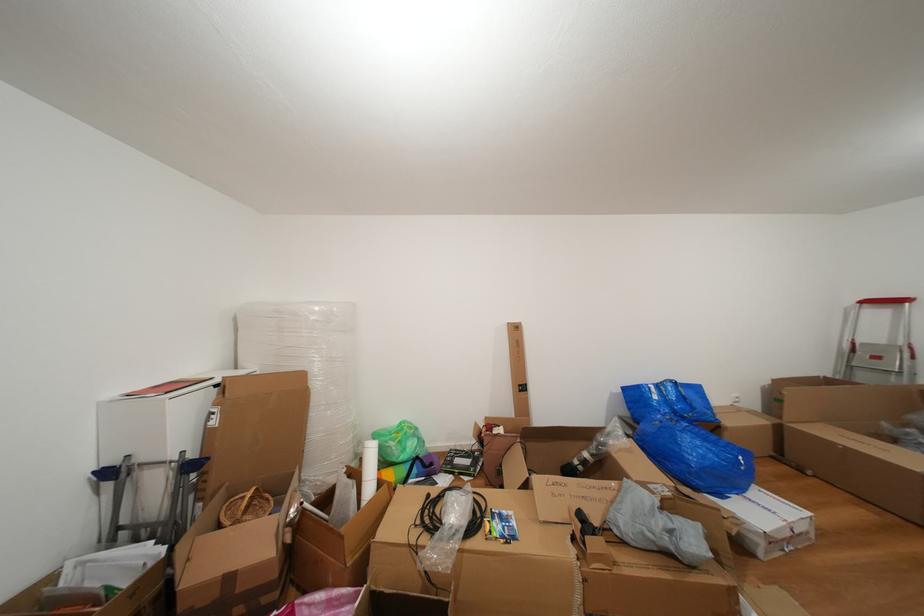
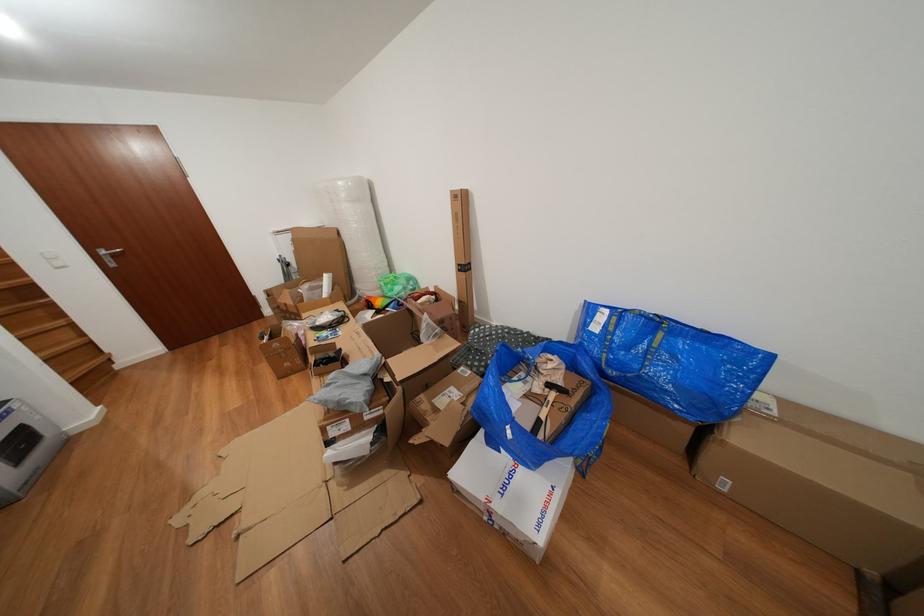
In the second image, find the point that corresponds to point 529,397 in the first image.

(468, 276)